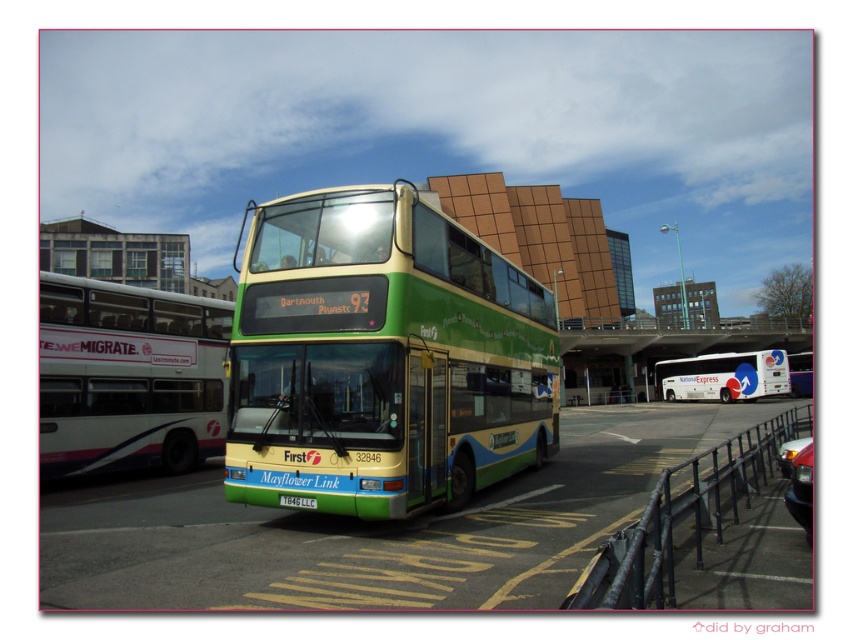
You are a bus driver who needs to park your green rubber bus at center in a garage that has a height restriction of 4 meters. The green plastic license plate at center is 15 cm tall. Can you determine if your bus will fit in the garage?

The green rubber bus at center is taller than the green plastic license plate at center, which is 15 cm tall. Since the height restriction is 4 meters, the bus will easily fit under the 4 meter limit.